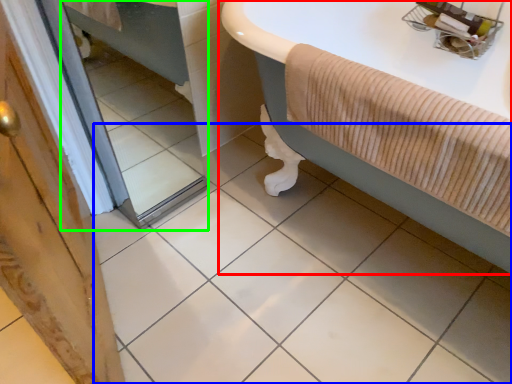
Question: Based on their relative distances, which object is nearer to bathtub (highlighted by a red box)? Choose from ceramic tile (highlighted by a blue box) and mirror (highlighted by a green box).

Choices:
 (A) ceramic tile
 (B) mirror

Answer: (A)